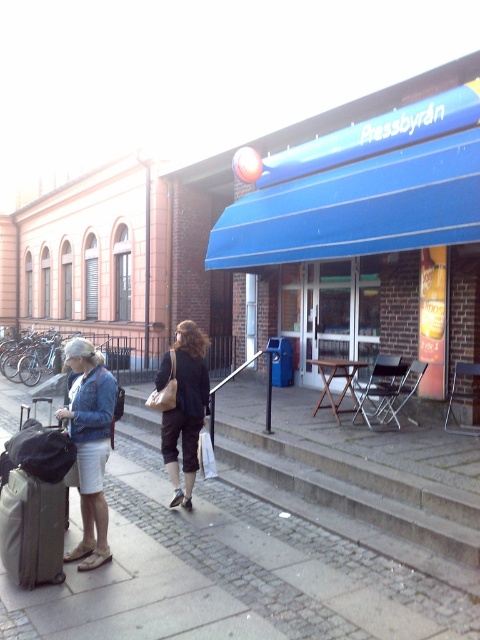
You are a window cleaner standing at the center of the street. You need to clean the blue awning at center and the matte black pants at center. Which object requires you to use a taller ladder?

The blue awning at center requires a taller ladder since it has a greater height compared to the matte black pants at center.

You are standing on the cobblestone pavement at lower left and want to pick up the denim jacket at left. In which direction should you move to reach it?

The cobblestone pavement at lower left is positioned on the right side of denim jacket at left. To reach the denim jacket at left, you should move to your left.